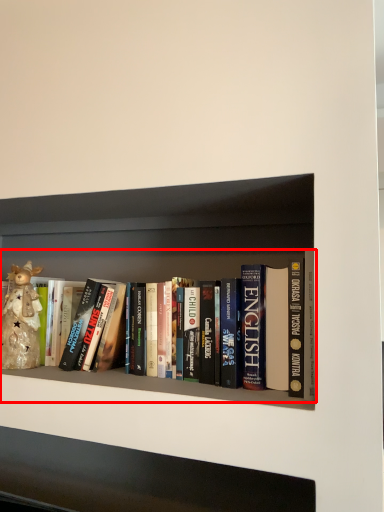
Question: From the image's perspective, considering the relative positions of book (annotated by the red box) and toy in the image provided, where is book (annotated by the red box) located with respect to the staircase?

Choices:
 (A) above
 (B) below

Answer: (A)